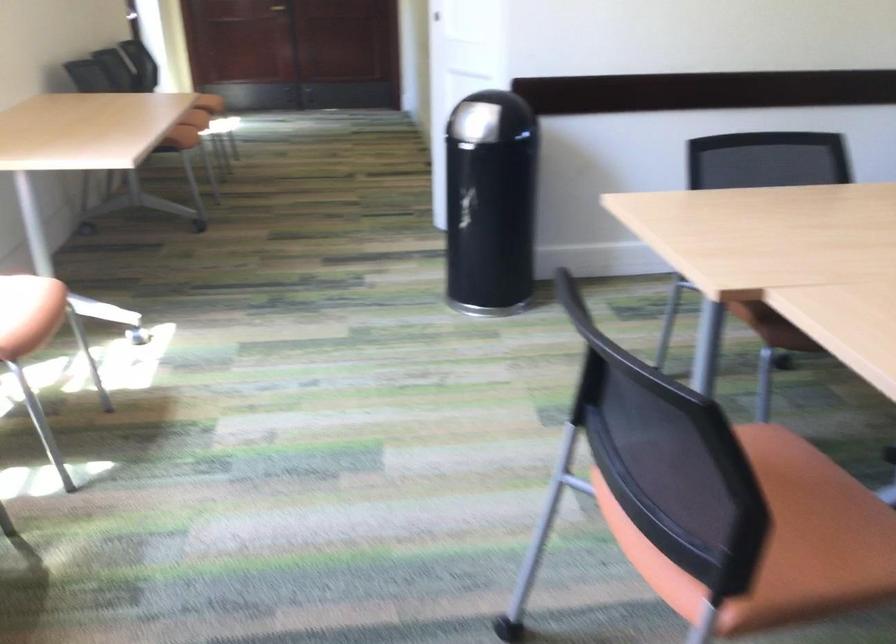
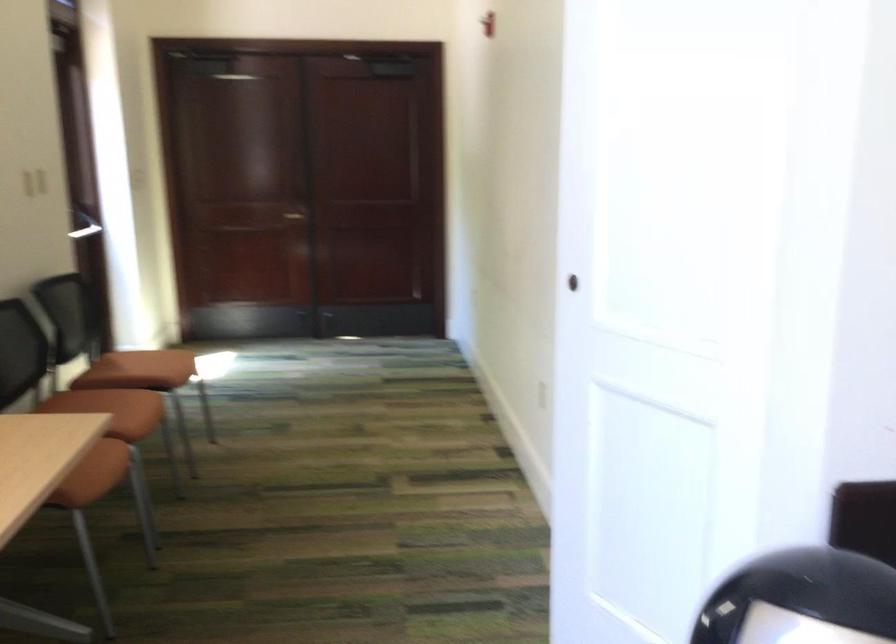
Where in the second image is the point corresponding to the point at 185,118 from the first image?

(106, 460)